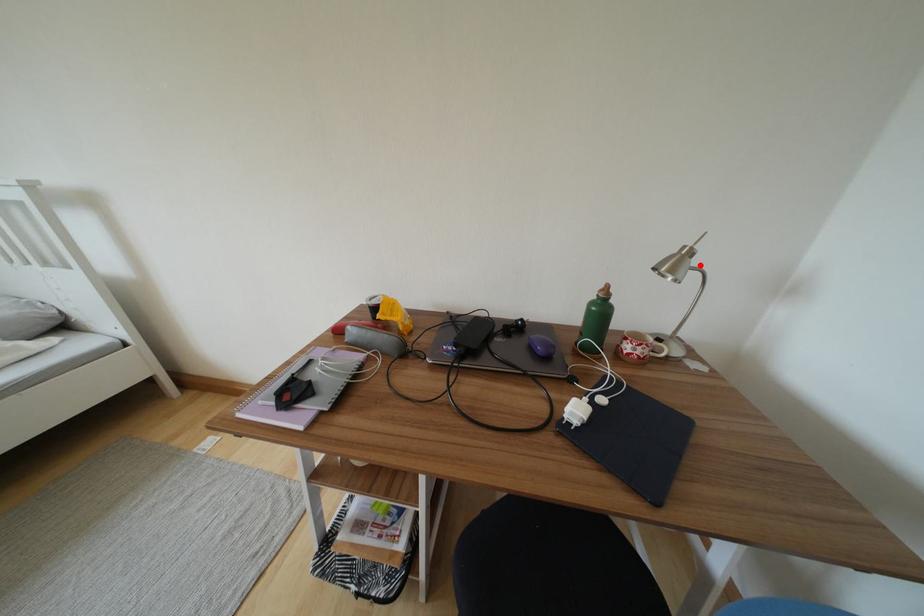
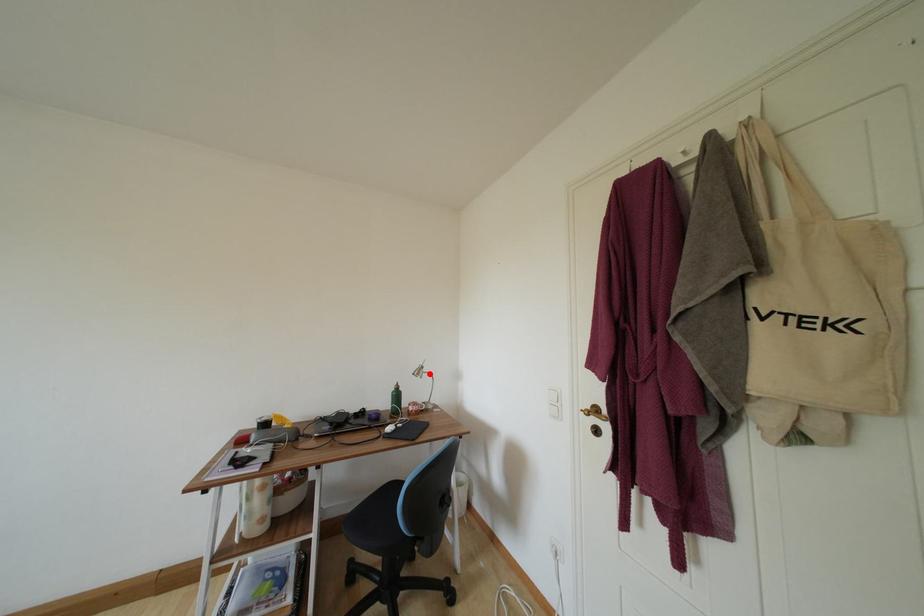
I am providing you with two images of the same scene from different viewpoints. A red point is marked on the first image and another point is marked on the second image. Is the marked point in image1 the same physical position as the marked point in image2?

Yes